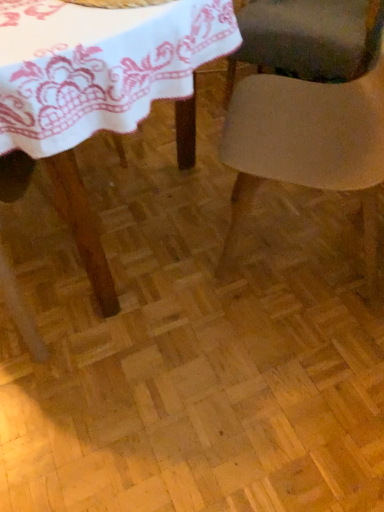
Question: Considering the relative sizes of smooth beige chair at center, placed as the second chair when sorted from top to bottom, and white lace tablecloth at upper left in the image provided, is smooth beige chair at center, placed as the second chair when sorted from top to bottom, bigger than white lace tablecloth at upper left?

Choices:
 (A) yes
 (B) no

Answer: (A)

Question: Does smooth beige chair at center, placed as the second chair when sorted from top to bottom, have a lesser height compared to white lace tablecloth at upper left?

Choices:
 (A) no
 (B) yes

Answer: (A)

Question: Could you tell me if smooth beige chair at center, the first chair from the front, is facing white lace tablecloth at upper left?

Choices:
 (A) yes
 (B) no

Answer: (A)

Question: Is smooth beige chair at center, placed as the second chair when sorted from top to bottom, smaller than white lace tablecloth at upper left?

Choices:
 (A) no
 (B) yes

Answer: (A)

Question: From the image's perspective, would you say smooth beige chair at center, which appears as the second chair when viewed from the back, is positioned over white lace tablecloth at upper left?

Choices:
 (A) yes
 (B) no

Answer: (B)

Question: Considering the relative sizes of white lace tablecloth at upper left and smooth beige chair at center, which appears as the second chair when viewed from the back, in the image provided, is white lace tablecloth at upper left bigger than smooth beige chair at center, which appears as the second chair when viewed from the back,?

Choices:
 (A) no
 (B) yes

Answer: (A)

Question: Is white lace tablecloth at upper left closer to the viewer compared to smooth beige chair at center, which appears as the 1th chair when ordered from the bottom?

Choices:
 (A) no
 (B) yes

Answer: (B)

Question: Is white lace tablecloth at upper left taller than smooth beige chair at center, which appears as the second chair when viewed from the back?

Choices:
 (A) no
 (B) yes

Answer: (A)

Question: From the image's perspective, is white lace tablecloth at upper left above smooth beige chair at center, placed as the second chair when sorted from top to bottom?

Choices:
 (A) yes
 (B) no

Answer: (A)

Question: From a real-world perspective, is white lace tablecloth at upper left on top of smooth beige chair at center, which appears as the 1th chair when ordered from the bottom?

Choices:
 (A) yes
 (B) no

Answer: (A)

Question: Considering the relative sizes of white lace tablecloth at upper left and smooth beige chair at center, the first chair from the front, in the image provided, is white lace tablecloth at upper left smaller than smooth beige chair at center, the first chair from the front,?

Choices:
 (A) no
 (B) yes

Answer: (B)

Question: Are smooth beige chair at center, the first chair from the front, and matte gray chair at center, which is counted as the first chair, starting from the back, far apart?

Choices:
 (A) yes
 (B) no

Answer: (B)